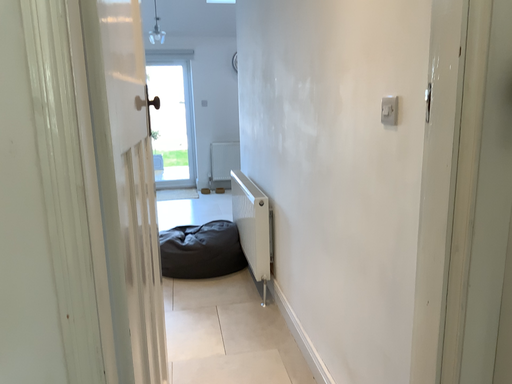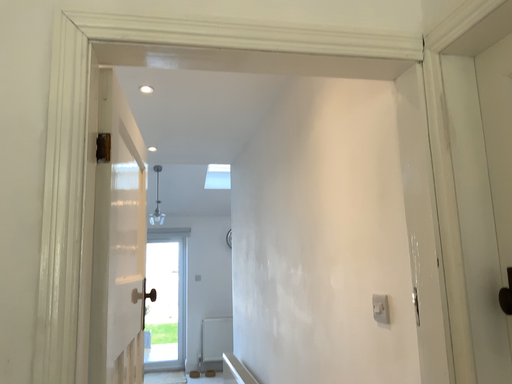
Question: Which way did the camera rotate in the video?

Choices:
 (A) rotated downward
 (B) rotated upward

Answer: (B)